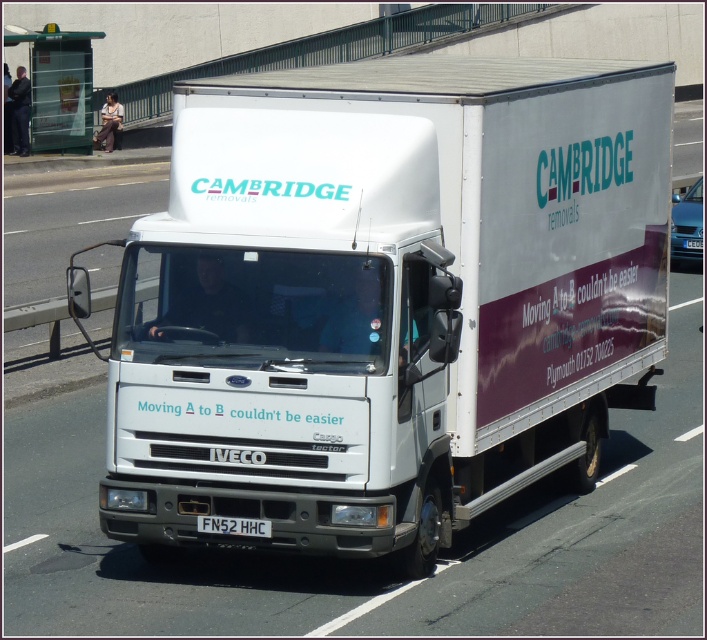
You are a delivery person who needs to attach a GPS tracker to the white matte truck at center. The GPS tracker must be placed exactly 4 feet away from the white plastic license plate at center. Is this possible?

The white matte truck at center and white plastic license plate at center are 4.40 feet apart. Since 4 feet is less than 4.40 feet, the GPS tracker can be placed 4 feet away from the license plate on the truck.

You are a delivery person who needs to park the white matte truck at center in a parking spot that is 2 meters wide. Can the truck fit in the parking spot based on its width compared to the white plastic license plate at center?

The white matte truck at center has a lesser width compared to the white plastic license plate at center, so the truck can fit in the 2 meter wide parking spot since it is narrower than the license plate.

You are standing at the side of the road watching the white Iveco Cargo Tector removal truck with Cambridge Removals on its side. The truck is moving forward. There are two points marked on the truck, one at coordinates point (268, 195) and the other at point (214, 525). Which point will pass by you first?

Point (268, 195) is in front of point (214, 525), so the point at (268, 195) will pass by you first.